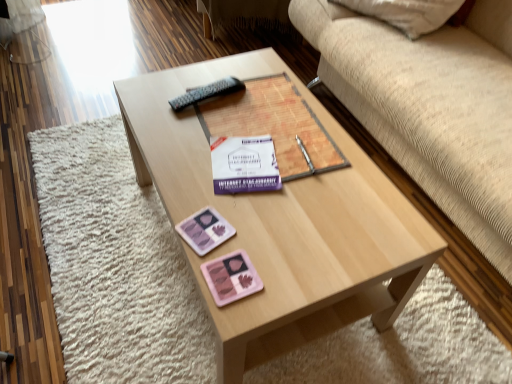
Question: Can you confirm if beige fabric couch at upper right is bigger than white paper at center?

Choices:
 (A) yes
 (B) no

Answer: (A)

Question: Is white paper at center located within beige fabric couch at upper right?

Choices:
 (A) no
 (B) yes

Answer: (A)

Question: Can you confirm if beige fabric couch at upper right is smaller than white paper at center?

Choices:
 (A) no
 (B) yes

Answer: (A)

Question: Can you confirm if beige fabric couch at upper right is positioned to the left of white paper at center?

Choices:
 (A) no
 (B) yes

Answer: (A)

Question: Is beige fabric couch at upper right not within white paper at center?

Choices:
 (A) no
 (B) yes

Answer: (B)

Question: Does beige fabric couch at upper right have a greater width compared to white paper at center?

Choices:
 (A) yes
 (B) no

Answer: (A)

Question: Is light wood coffee table at center outside of white paper at center?

Choices:
 (A) yes
 (B) no

Answer: (A)

Question: Is light wood coffee table at center positioned with its back to white paper at center?

Choices:
 (A) yes
 (B) no

Answer: (B)

Question: From the image's perspective, is light wood coffee table at center above white paper at center?

Choices:
 (A) no
 (B) yes

Answer: (A)

Question: Considering the relative sizes of light wood coffee table at center and white paper at center in the image provided, is light wood coffee table at center taller than white paper at center?

Choices:
 (A) yes
 (B) no

Answer: (A)

Question: Is white paper at center located within light wood coffee table at center?

Choices:
 (A) yes
 (B) no

Answer: (A)

Question: Is light wood coffee table at center closer to camera compared to white paper at center?

Choices:
 (A) yes
 (B) no

Answer: (A)

Question: Is pink matte eyeshadow palette at lower center, which is the second currency from top to bottom, shorter than beige fabric couch at upper right?

Choices:
 (A) yes
 (B) no

Answer: (A)